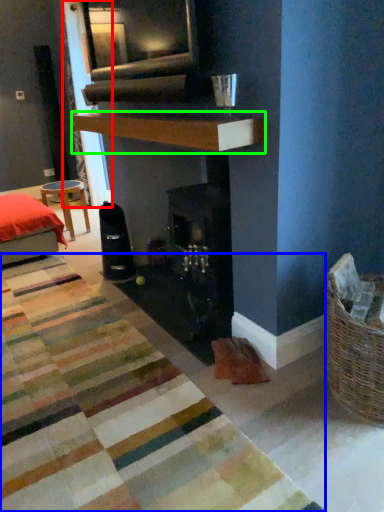
Question: Which object is positioned closest to curtain (highlighted by a red box)? Select from mat (highlighted by a blue box) and mantle (highlighted by a green box).

Choices:
 (A) mat
 (B) mantle

Answer: (B)